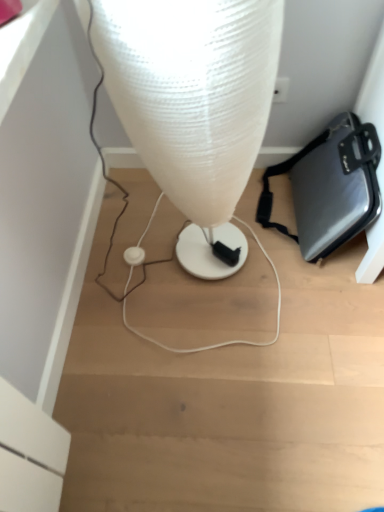
Question: Considering the relative sizes of translucent plastic lamp at center and white plastic earphone at center in the image provided, is translucent plastic lamp at center wider than white plastic earphone at center?

Choices:
 (A) no
 (B) yes

Answer: (B)

Question: From a real-world perspective, is translucent plastic lamp at center on white plastic earphone at center?

Choices:
 (A) yes
 (B) no

Answer: (A)

Question: Are translucent plastic lamp at center and white plastic earphone at center located far from each other?

Choices:
 (A) no
 (B) yes

Answer: (A)

Question: Considering the relative sizes of translucent plastic lamp at center and white plastic earphone at center in the image provided, is translucent plastic lamp at center thinner than white plastic earphone at center?

Choices:
 (A) no
 (B) yes

Answer: (A)

Question: Is translucent plastic lamp at center oriented towards white plastic earphone at center?

Choices:
 (A) yes
 (B) no

Answer: (B)

Question: From a real-world perspective, is translucent plastic lamp at center positioned above or below white plastic earphone at center?

Choices:
 (A) above
 (B) below

Answer: (A)

Question: In terms of height, does translucent plastic lamp at center look taller or shorter compared to white plastic earphone at center?

Choices:
 (A) tall
 (B) short

Answer: (A)

Question: From the image's perspective, is translucent plastic lamp at center located above or below white plastic earphone at center?

Choices:
 (A) below
 (B) above

Answer: (B)

Question: Choose the correct answer: Is translucent plastic lamp at center inside white plastic earphone at center or outside it?

Choices:
 (A) inside
 (B) outside

Answer: (B)

Question: Does point (127, 253) appear closer or farther from the camera than point (225, 105)?

Choices:
 (A) farther
 (B) closer

Answer: (A)

Question: In terms of height, does white plastic earphone at center look taller or shorter compared to translucent plastic lamp at center?

Choices:
 (A) short
 (B) tall

Answer: (A)

Question: Would you say white plastic earphone at center is inside or outside translucent plastic lamp at center?

Choices:
 (A) outside
 (B) inside

Answer: (A)

Question: Considering the positions of white plastic earphone at center and translucent plastic lamp at center in the image, is white plastic earphone at center bigger or smaller than translucent plastic lamp at center?

Choices:
 (A) big
 (B) small

Answer: (B)

Question: Considering their positions, is metallic gray briefcase at lower right located in front of or behind translucent plastic lamp at center?

Choices:
 (A) front
 (B) behind

Answer: (B)

Question: Based on their sizes in the image, would you say metallic gray briefcase at lower right is bigger or smaller than translucent plastic lamp at center?

Choices:
 (A) big
 (B) small

Answer: (B)